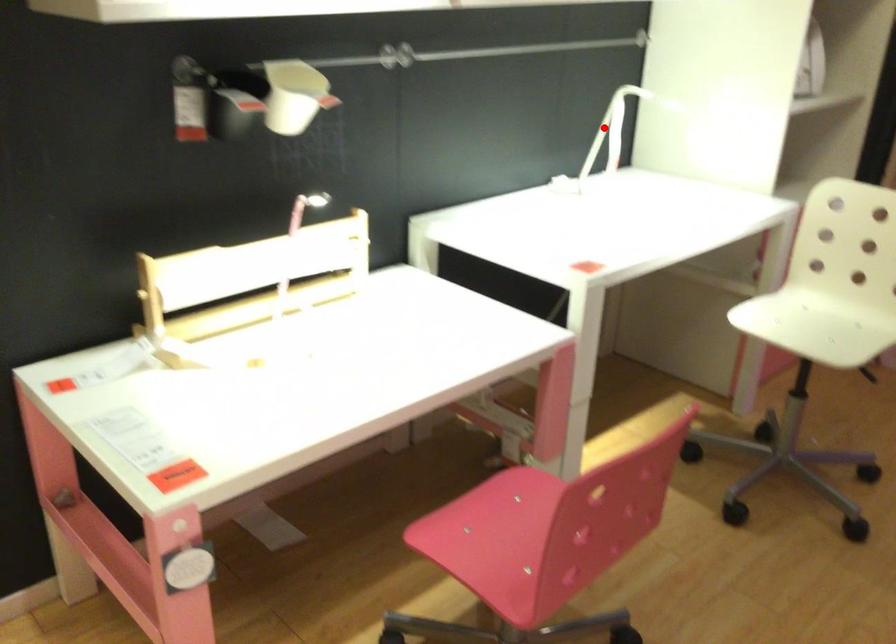
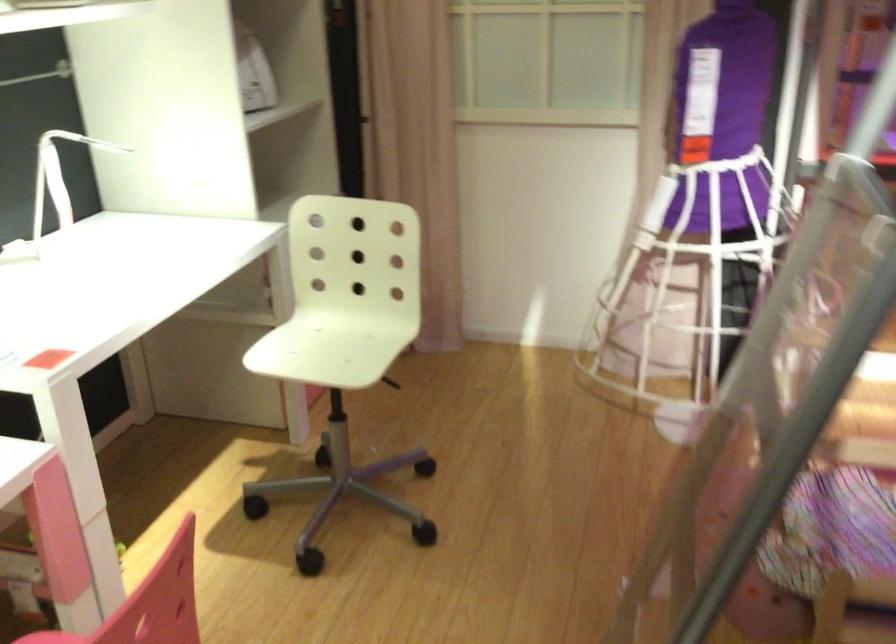
Question: I am providing you with two images of the same scene from different viewpoints. A red point is shown in image1. For the corresponding object point in image2, is it positioned nearer or farther from the camera?

Choices:
 (A) Nearer
 (B) Farther

Answer: (A)